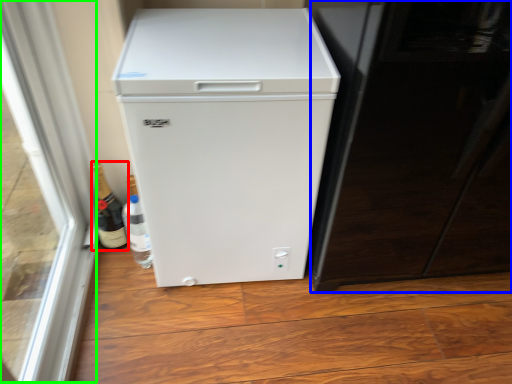
Question: Which object is positioned closest to bottle (highlighted by a red box)? Select from screen door (highlighted by a blue box) and glass door (highlighted by a green box).

Choices:
 (A) screen door
 (B) glass door

Answer: (B)